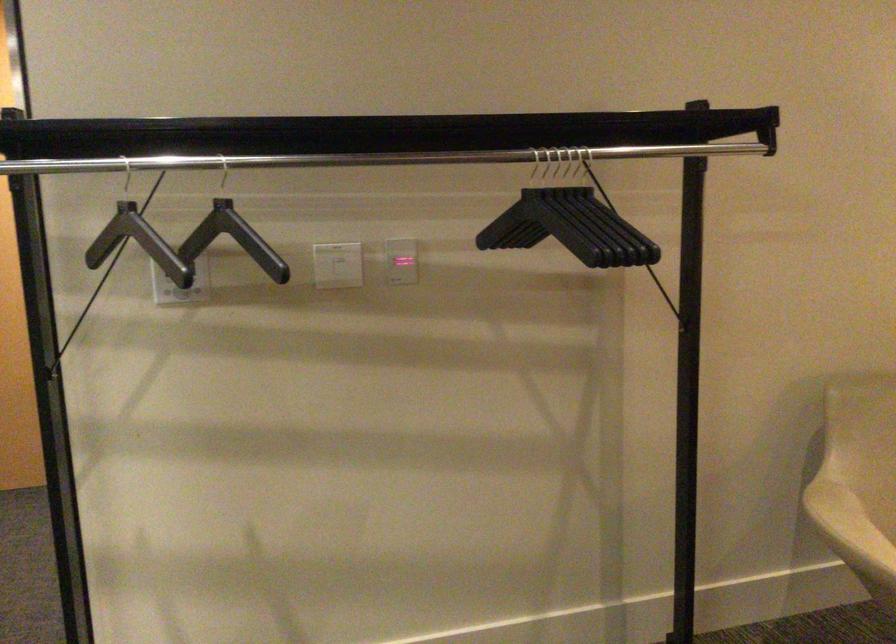
Locate an element on the screen. The image size is (896, 644). white light switch is located at coordinates (337, 265).